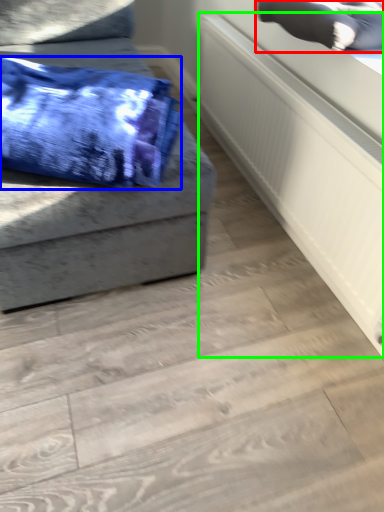
Question: Estimate the real-world distances between objects in this image. Which object is farther from pillow (highlighted by a red box), blanket (highlighted by a blue box) or radiator (highlighted by a green box)?

Choices:
 (A) blanket
 (B) radiator

Answer: (A)